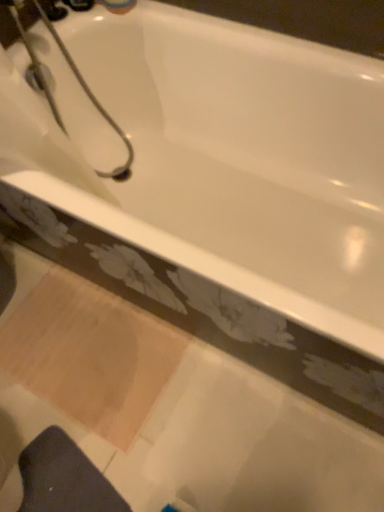
Locate an element on the screen. Image resolution: width=384 pixels, height=512 pixels. white ceramic shower at upper left is located at coordinates (91, 100).

What do you see at coordinates (91, 100) in the screenshot? This screenshot has width=384, height=512. I see `white ceramic shower at upper left` at bounding box center [91, 100].

Locate an element on the screen. white ceramic shower at upper left is located at coordinates (91, 100).